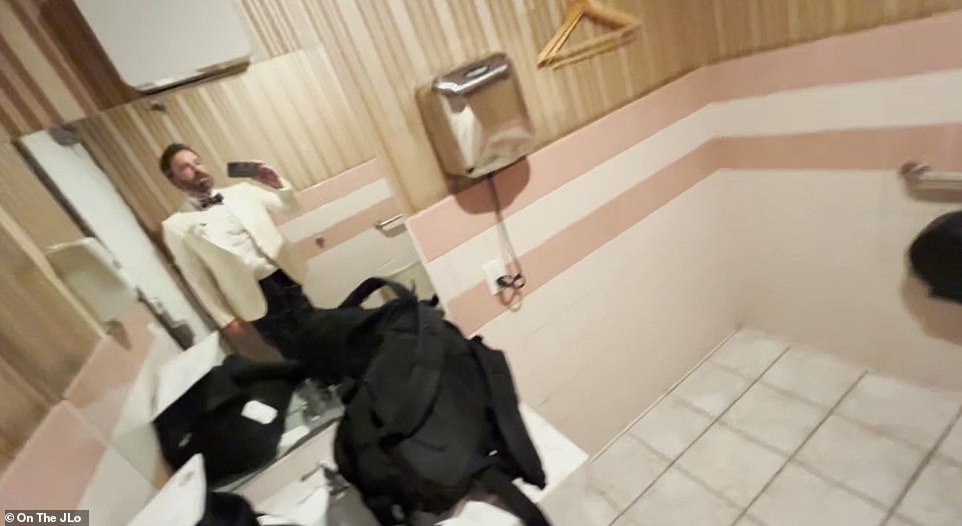
Identify the location of grout. (757, 487).